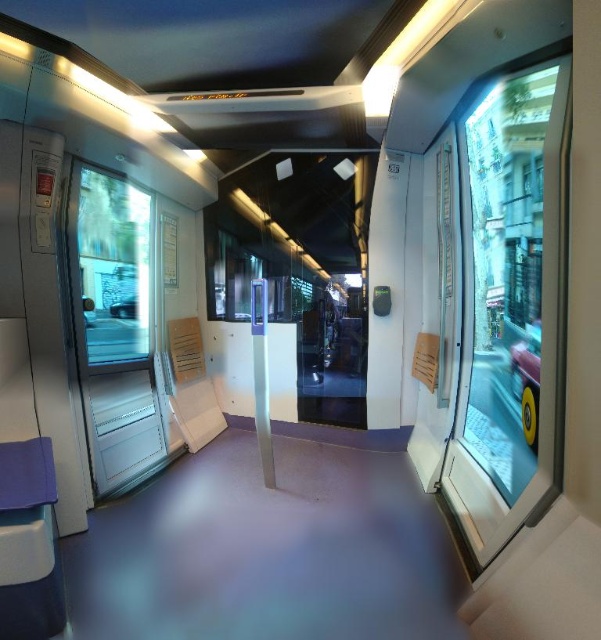
Does transparent glass window at right appear on the left side of transparent glass window at left?

No, transparent glass window at right is not to the left of transparent glass window at left.

Where is `transparent glass window at right`? The width and height of the screenshot is (601, 640). transparent glass window at right is located at coordinates (510, 304).